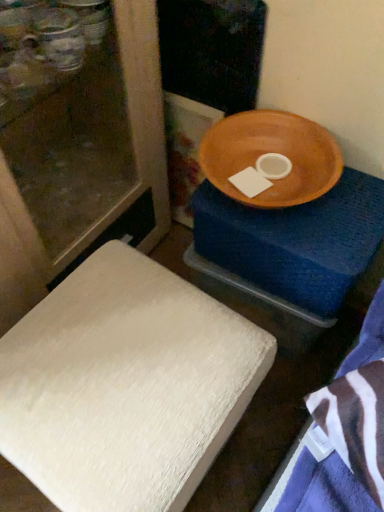
The height and width of the screenshot is (512, 384). What do you see at coordinates (295, 241) in the screenshot?
I see `wooden bowl at upper right` at bounding box center [295, 241].

Find the location of a particular element. The height and width of the screenshot is (512, 384). wooden bowl at upper right is located at coordinates (295, 241).

The image size is (384, 512). What are the coordinates of `white textured cushion at lower left` in the screenshot? It's located at (125, 385).

What do you see at coordinates (125, 385) in the screenshot? I see `white textured cushion at lower left` at bounding box center [125, 385].

Measure the distance between point (82, 503) and camera.

Point (82, 503) and camera are 24.25 inches apart from each other.

The width and height of the screenshot is (384, 512). Identify the location of wooden bowl at upper right. (295, 241).

Which is more to the right, white textured cushion at lower left or wooden bowl at upper right?

wooden bowl at upper right is more to the right.

Is white textured cushion at lower left closer to the viewer compared to wooden bowl at upper right?

Yes, white textured cushion at lower left is closer to the viewer.

Which is behind, point (76, 400) or point (215, 202)?

Positioned behind is point (215, 202).

From the image's perspective, which is below, white textured cushion at lower left or wooden bowl at upper right?

From the image's view, white textured cushion at lower left is below.

From a real-world perspective, is white textured cushion at lower left above or below wooden bowl at upper right?

Clearly, from a real-world perspective, white textured cushion at lower left is above wooden bowl at upper right.

Does white textured cushion at lower left have a greater width compared to wooden bowl at upper right?

Correct, the width of white textured cushion at lower left exceeds that of wooden bowl at upper right.

Considering the relative sizes of white textured cushion at lower left and wooden bowl at upper right in the image provided, is white textured cushion at lower left taller than wooden bowl at upper right?

In fact, white textured cushion at lower left may be shorter than wooden bowl at upper right.

Can you confirm if white textured cushion at lower left is bigger than wooden bowl at upper right?

Yes.

In the scene shown: Which is correct: white textured cushion at lower left is inside wooden bowl at upper right, or outside of it?

white textured cushion at lower left lies outside wooden bowl at upper right.

Are white textured cushion at lower left and wooden bowl at upper right located far from each other?

white textured cushion at lower left is near wooden bowl at upper right, not far away.

Is white textured cushion at lower left oriented away from wooden bowl at upper right?

Yes, wooden bowl at upper right is at the back of white textured cushion at lower left.

How different are the orientations of white textured cushion at lower left and wooden bowl at upper right in degrees?

white textured cushion at lower left and wooden bowl at upper right are facing 0.59 degrees away from each other.

Identify the location of furniture on the left of wooden bowl at upper right. This screenshot has width=384, height=512. (125, 385).

Considering the relative positions of wooden bowl at upper right and white textured cushion at lower left in the image provided, is wooden bowl at upper right to the left or to the right of white textured cushion at lower left?

Clearly, wooden bowl at upper right is on the right of white textured cushion at lower left in the image.

Is wooden bowl at upper right closer to the viewer compared to white textured cushion at lower left?

No, wooden bowl at upper right is further to the viewer.

Considering the positions of points (238, 221) and (174, 398), is point (238, 221) closer to camera compared to point (174, 398)?

No, (238, 221) is behind (174, 398).

From the image's perspective, is wooden bowl at upper right located above or below white textured cushion at lower left?

From the image's perspective, wooden bowl at upper right appears above white textured cushion at lower left.

From a real-world perspective, is wooden bowl at upper right positioned above or below white textured cushion at lower left?

wooden bowl at upper right is situated lower than white textured cushion at lower left in the real world.

Is wooden bowl at upper right wider than white textured cushion at lower left?

No, wooden bowl at upper right is not wider than white textured cushion at lower left.

From the picture: Considering the sizes of objects wooden bowl at upper right and white textured cushion at lower left in the image provided, who is shorter, wooden bowl at upper right or white textured cushion at lower left?

Standing shorter between the two is white textured cushion at lower left.

Can you confirm if wooden bowl at upper right is bigger than white textured cushion at lower left?

No, wooden bowl at upper right is not bigger than white textured cushion at lower left.

Could white textured cushion at lower left be considered to be inside wooden bowl at upper right?

No, white textured cushion at lower left is located outside of wooden bowl at upper right.

Is wooden bowl at upper right positioned far away from white textured cushion at lower left?

No, there isn't a large distance between wooden bowl at upper right and white textured cushion at lower left.

In the scene shown: Is wooden bowl at upper right facing towards white textured cushion at lower left?

Yes, wooden bowl at upper right is oriented towards white textured cushion at lower left.

Measure the distance from wooden bowl at upper right to white textured cushion at lower left.

wooden bowl at upper right is 12.01 inches from white textured cushion at lower left.

This screenshot has width=384, height=512. I want to click on changing table located on the right of white textured cushion at lower left, so click(x=295, y=241).

The width and height of the screenshot is (384, 512). There is a wooden bowl at upper right. In order to click on furniture above it (from a real-world perspective) in this screenshot , I will do `click(125, 385)`.

Image resolution: width=384 pixels, height=512 pixels. Identify the location of changing table located on the right of white textured cushion at lower left. click(x=295, y=241).